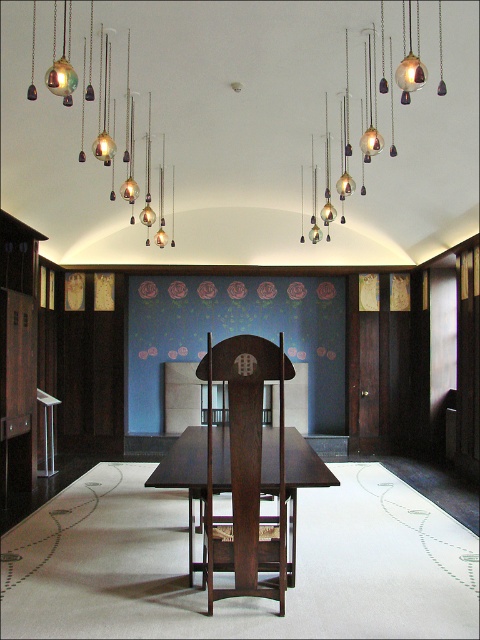
Between dark wood chair at center and dark wood table at center, which one is positioned higher?

dark wood chair at center is higher up.

Who is positioned more to the left, dark wood chair at center or dark wood table at center?

dark wood table at center

Identify the location of dark wood chair at center. The width and height of the screenshot is (480, 640). (245, 472).

Which of these two, dark wood chair at center or metallic glass pendants at upper center, stands taller?

Standing taller between the two is dark wood chair at center.

Is point (233, 518) farther from camera compared to point (389, 42)?

No.

Locate an element on the screen. Image resolution: width=480 pixels, height=640 pixels. dark wood chair at center is located at coordinates (245, 472).

Between metallic glass globe chandelier at upper left and metallic glass pendants at upper center, which one is positioned lower?

Positioned lower is metallic glass pendants at upper center.

Does metallic glass globe chandelier at upper left have a larger size compared to metallic glass pendants at upper center?

Yes, metallic glass globe chandelier at upper left is bigger than metallic glass pendants at upper center.

Is point (107, 77) positioned after point (372, 115)?

No, it is in front of (372, 115).

Where is `metallic glass globe chandelier at upper left`? The image size is (480, 640). metallic glass globe chandelier at upper left is located at coordinates (105, 112).